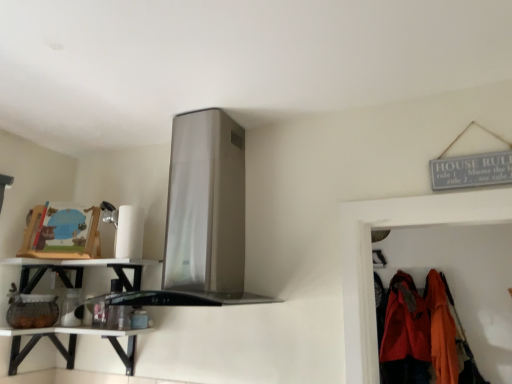
What is the approximate height of matte orange jacket at lower right, which is the second clothing from right to left?

33.07 inches.

Image resolution: width=512 pixels, height=384 pixels. Identify the location of satin silver exhaust hood at upper center. (201, 214).

Image resolution: width=512 pixels, height=384 pixels. I want to click on matte orange jacket at lower right, which is the second clothing from right to left, so coord(405,334).

From the picture: Is matte orange jacket at lower right, which is the second clothing from right to left, situated inside white glossy shelf at lower left or outside?

matte orange jacket at lower right, which is the second clothing from right to left, is spatially situated outside white glossy shelf at lower left.

Looking at this image, from a real-world perspective, does matte orange jacket at lower right, which is the second clothing from right to left, stand above white glossy shelf at lower left?

No, from a real-world perspective, matte orange jacket at lower right, which is the second clothing from right to left, is not above white glossy shelf at lower left.

Does matte orange jacket at lower right, arranged as the first clothing when viewed from the left, have a lesser height compared to white glossy shelf at lower left?

No, matte orange jacket at lower right, arranged as the first clothing when viewed from the left, is not shorter than white glossy shelf at lower left.

Which object is closer to the camera taking this photo, matte orange jacket at lower right, arranged as the first clothing when viewed from the left, or white glossy shelf at lower left?

white glossy shelf at lower left is in front.

Could you tell me if white glossy shelf at lower left is turned towards matte orange jacket at lower right, which is the second clothing from right to left?

No, white glossy shelf at lower left is not aimed at matte orange jacket at lower right, which is the second clothing from right to left.

Would you say white glossy shelf at lower left is inside or outside matte orange jacket at lower right, which is the second clothing from right to left?

white glossy shelf at lower left is not enclosed by matte orange jacket at lower right, which is the second clothing from right to left.

Based on their positions, is white glossy shelf at lower left located to the left or right of matte orange jacket at lower right, arranged as the first clothing when viewed from the left?

In the image, white glossy shelf at lower left appears on the left side of matte orange jacket at lower right, arranged as the first clothing when viewed from the left.

In the image, is matte orange jacket at lower right, arranged as the first clothing when viewed from the left, positioned in front of or behind satin silver exhaust hood at upper center?

matte orange jacket at lower right, arranged as the first clothing when viewed from the left, is positioned farther from the viewer than satin silver exhaust hood at upper center.

Could satin silver exhaust hood at upper center be considered to be inside matte orange jacket at lower right, which is the second clothing from right to left?

No, satin silver exhaust hood at upper center is located outside of matte orange jacket at lower right, which is the second clothing from right to left.

Considering the sizes of objects matte orange jacket at lower right, which is the second clothing from right to left, and satin silver exhaust hood at upper center in the image provided, who is bigger, matte orange jacket at lower right, which is the second clothing from right to left, or satin silver exhaust hood at upper center?

With larger size is satin silver exhaust hood at upper center.

From the image's perspective, which is above, white glossy shelf at lower left or orange fabric coat at right, the second clothing in the left-to-right sequence?

white glossy shelf at lower left.

Is white glossy shelf at lower left positioned with its back to orange fabric coat at right, acting as the first clothing starting from the right?

white glossy shelf at lower left does not have its back to orange fabric coat at right, acting as the first clothing starting from the right.

From the image's perspective, which clothing is the 1st one below the white glossy shelf at lower left? Please provide its 2D coordinates.

[(441, 330)]

From a real-world perspective, who is located lower, white glossy shelf at lower left or orange fabric coat at right, the second clothing in the left-to-right sequence?

orange fabric coat at right, the second clothing in the left-to-right sequence, from a real-world perspective.

Can you see white glossy shelf at lower left touching orange fabric coat at right, the second clothing in the left-to-right sequence?

white glossy shelf at lower left and orange fabric coat at right, the second clothing in the left-to-right sequence, are clearly separated.

Which is more to the left, white glossy shelf at lower left or orange fabric coat at right, the second clothing in the left-to-right sequence?

From the viewer's perspective, white glossy shelf at lower left appears more on the left side.

Considering the sizes of white glossy shelf at lower left and orange fabric coat at right, the second clothing in the left-to-right sequence, in the image, is white glossy shelf at lower left wider or thinner than orange fabric coat at right, the second clothing in the left-to-right sequence,?

In the image, white glossy shelf at lower left appears to be wider than orange fabric coat at right, the second clothing in the left-to-right sequence.

You are a GUI agent. You are given a task and a screenshot of the screen. Output one action in this format:
    pyautogui.click(x=<x>, y=<y>)
    Task: Click on the counter above the orange fabric coat at right, the second clothing in the left-to-right sequence (from the image's perspective)
    Image resolution: width=512 pixels, height=384 pixels.
    Given the screenshot: What is the action you would take?
    pyautogui.click(x=70, y=343)

How different are the orientations of white glossy shelf at lower left and white glossy shelf at lower left in degrees?

They differ by 3.39e-05 degrees in their facing directions.

Would you say white glossy shelf at lower left is part of white glossy shelf at lower left's contents?

Definitely not — white glossy shelf at lower left is not inside white glossy shelf at lower left.

How far apart are white glossy shelf at lower left and white glossy shelf at lower left?

white glossy shelf at lower left and white glossy shelf at lower left are 3.18 inches apart.

From a real-world perspective, is white glossy shelf at lower left positioned under white glossy shelf at lower left based on gravity?

Incorrect, from a real-world perspective, white glossy shelf at lower left is higher than white glossy shelf at lower left.

Which of these two, white glossy shelf at lower left or satin silver exhaust hood at upper center, is thinner?

Thinner between the two is white glossy shelf at lower left.

Is white glossy shelf at lower left facing towards satin silver exhaust hood at upper center?

No, white glossy shelf at lower left is not oriented towards satin silver exhaust hood at upper center.

Is point (65, 355) positioned behind point (202, 195)?

Yes, point (65, 355) is farther from viewer.

This screenshot has height=384, width=512. In the image, there is a matte orange jacket at lower right, which is the second clothing from right to left. In order to click on shelf above it (from the image's perspective) in this screenshot , I will do `click(70, 344)`.

Where is `the 2nd clothing below the white glossy shelf at lower left (from a real-world perspective)`? This screenshot has width=512, height=384. the 2nd clothing below the white glossy shelf at lower left (from a real-world perspective) is located at coordinates [x=405, y=334].

Which object lies further to the anchor point matte orange jacket at lower right, arranged as the first clothing when viewed from the left, satin silver exhaust hood at upper center or white glossy shelf at lower left?

white glossy shelf at lower left is further to matte orange jacket at lower right, arranged as the first clothing when viewed from the left.

Considering their positions, is orange fabric coat at right, acting as the first clothing starting from the right, positioned further to white glossy shelf at lower left than satin silver exhaust hood at upper center?

orange fabric coat at right, acting as the first clothing starting from the right, is further to white glossy shelf at lower left.

Based on their spatial positions, is white glossy shelf at lower left or satin silver exhaust hood at upper center closer to white glossy shelf at lower left?

Among the two, white glossy shelf at lower left is located nearer to white glossy shelf at lower left.

Looking at the image, which one is located closer to matte orange jacket at lower right, which is the second clothing from right to left, white glossy shelf at lower left or orange fabric coat at right, acting as the first clothing starting from the right?

Based on the image, orange fabric coat at right, acting as the first clothing starting from the right, appears to be nearer to matte orange jacket at lower right, which is the second clothing from right to left.

From the image, which object appears to be farther from white glossy shelf at lower left, white glossy shelf at lower left or satin silver exhaust hood at upper center?

satin silver exhaust hood at upper center is positioned further to the anchor white glossy shelf at lower left.

Looking at the image, which one is located closer to white glossy shelf at lower left, white glossy shelf at lower left or orange fabric coat at right, acting as the first clothing starting from the right?

white glossy shelf at lower left.

Considering their positions, is satin silver exhaust hood at upper center positioned closer to matte orange jacket at lower right, arranged as the first clothing when viewed from the left, than orange fabric coat at right, the second clothing in the left-to-right sequence?

The object closer to matte orange jacket at lower right, arranged as the first clothing when viewed from the left, is orange fabric coat at right, the second clothing in the left-to-right sequence.

Estimate the real-world distances between objects in this image. Which object is closer to white glossy shelf at lower left, satin silver exhaust hood at upper center or orange fabric coat at right, acting as the first clothing starting from the right?

satin silver exhaust hood at upper center is closer to white glossy shelf at lower left.

The width and height of the screenshot is (512, 384). I want to click on clothing situated between white glossy shelf at lower left and orange fabric coat at right, acting as the first clothing starting from the right, from left to right, so 405,334.

You are a GUI agent. You are given a task and a screenshot of the screen. Output one action in this format:
    pyautogui.click(x=<x>, y=<y>)
    Task: Click on the clothing between satin silver exhaust hood at upper center and matte orange jacket at lower right, arranged as the first clothing when viewed from the left, along the z-axis
    This screenshot has height=384, width=512.
    Given the screenshot: What is the action you would take?
    pyautogui.click(x=441, y=330)

Identify the location of exhaust hood located between white glossy shelf at lower left and orange fabric coat at right, acting as the first clothing starting from the right, in the left-right direction. The image size is (512, 384). (201, 214).

This screenshot has height=384, width=512. What are the coordinates of `exhaust hood between white glossy shelf at lower left and orange fabric coat at right, the second clothing in the left-to-right sequence` in the screenshot? It's located at (201, 214).